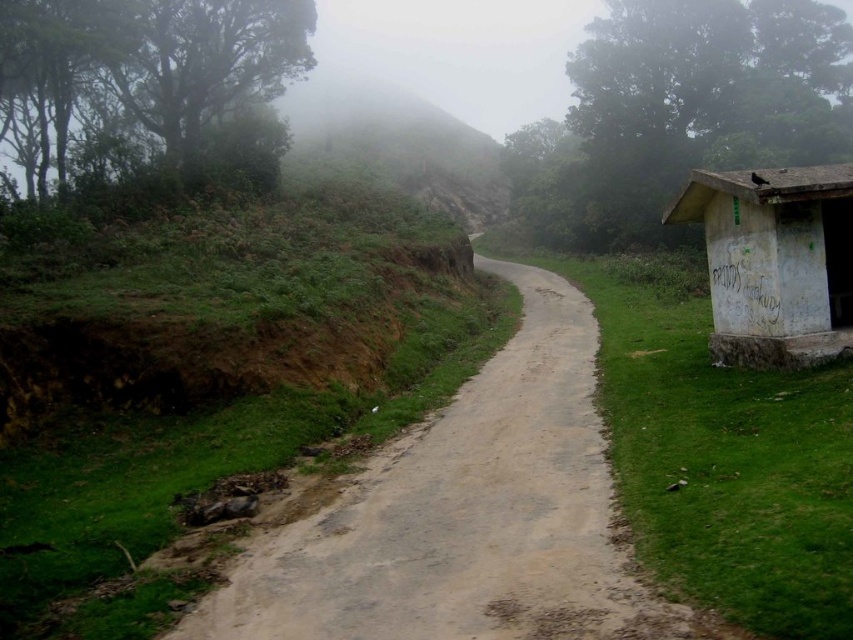
Is dull gray concrete path at center shorter than white concrete hut at right?

Indeed, dull gray concrete path at center has a lesser height compared to white concrete hut at right.

Image resolution: width=853 pixels, height=640 pixels. What do you see at coordinates (468, 516) in the screenshot?
I see `dull gray concrete path at center` at bounding box center [468, 516].

Describe the element at coordinates (468, 516) in the screenshot. I see `dull gray concrete path at center` at that location.

Find the location of a particular element. This screenshot has height=640, width=853. dull gray concrete path at center is located at coordinates (468, 516).